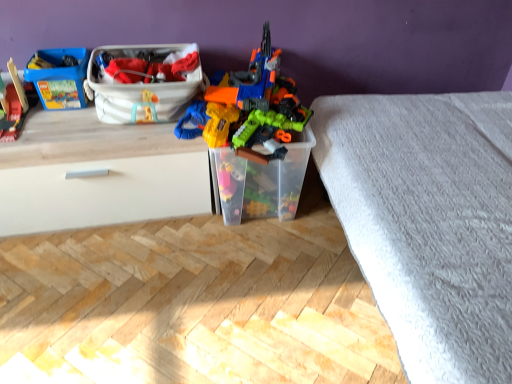
Question: Can you confirm if wooden train at left, which is counted as the first toy, starting from the left, is thinner than matte plastic lego box at upper left, which appears as the third storage box when viewed from the right?

Choices:
 (A) no
 (B) yes

Answer: (A)

Question: Is wooden train at left, the 2th toy in the right-to-left sequence, to the right of matte plastic lego box at upper left, which appears as the third storage box when viewed from the right, from the viewer's perspective?

Choices:
 (A) yes
 (B) no

Answer: (B)

Question: Is wooden train at left, which is counted as the first toy, starting from the left, taller than matte plastic lego box at upper left, which appears as the third storage box when viewed from the right?

Choices:
 (A) yes
 (B) no

Answer: (A)

Question: Does wooden train at left, which is counted as the first toy, starting from the left, appear on the left side of matte plastic lego box at upper left, placed as the 1th storage box when sorted from left to right?

Choices:
 (A) no
 (B) yes

Answer: (B)

Question: Does wooden train at left, which is counted as the first toy, starting from the left, turn towards matte plastic lego box at upper left, placed as the 1th storage box when sorted from left to right?

Choices:
 (A) no
 (B) yes

Answer: (A)

Question: Would you say matte plastic lego box at upper left, placed as the 1th storage box when sorted from left to right, is to the left or to the right of translucent plastic toy at center, the first toy viewed from the right, in the picture?

Choices:
 (A) left
 (B) right

Answer: (A)

Question: Is matte plastic lego box at upper left, placed as the 1th storage box when sorted from left to right, in front of or behind translucent plastic toy at center, the first toy viewed from the right, in the image?

Choices:
 (A) front
 (B) behind

Answer: (B)

Question: From a real-world perspective, is matte plastic lego box at upper left, placed as the 1th storage box when sorted from left to right, physically located above or below translucent plastic toy at center, which is the second toy in left-to-right order?

Choices:
 (A) above
 (B) below

Answer: (B)

Question: From the image's perspective, is matte plastic lego box at upper left, which appears as the third storage box when viewed from the right, located above or below translucent plastic toy at center, which is the second toy in left-to-right order?

Choices:
 (A) above
 (B) below

Answer: (A)

Question: In terms of size, does wooden train at left, the 2th toy in the right-to-left sequence, appear bigger or smaller than transparent plastic container at center, which appears as the 1th storage box when viewed from the right?

Choices:
 (A) big
 (B) small

Answer: (B)

Question: Is wooden train at left, which is counted as the first toy, starting from the left, in front of or behind transparent plastic container at center, which appears as the 1th storage box when viewed from the right, in the image?

Choices:
 (A) behind
 (B) front

Answer: (B)

Question: In terms of height, does wooden train at left, the 2th toy in the right-to-left sequence, look taller or shorter compared to transparent plastic container at center, which appears as the 1th storage box when viewed from the right?

Choices:
 (A) tall
 (B) short

Answer: (B)

Question: From the image's perspective, is wooden train at left, which is counted as the first toy, starting from the left, located above or below transparent plastic container at center, which appears as the 1th storage box when viewed from the right?

Choices:
 (A) above
 (B) below

Answer: (A)

Question: Choose the correct answer: Is white matte drawer at left inside wooden train at left, which is counted as the first toy, starting from the left, or outside it?

Choices:
 (A) outside
 (B) inside

Answer: (A)

Question: In terms of size, does white matte drawer at left appear bigger or smaller than wooden train at left, which is counted as the first toy, starting from the left?

Choices:
 (A) big
 (B) small

Answer: (A)